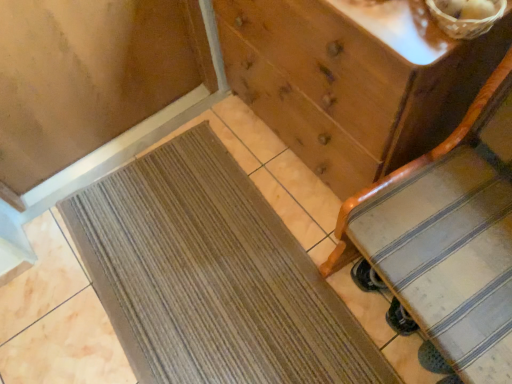
Identify the location of vacant area situated below brown woven mat at lower left (from a real-world perspective). This screenshot has width=512, height=384. (208, 274).